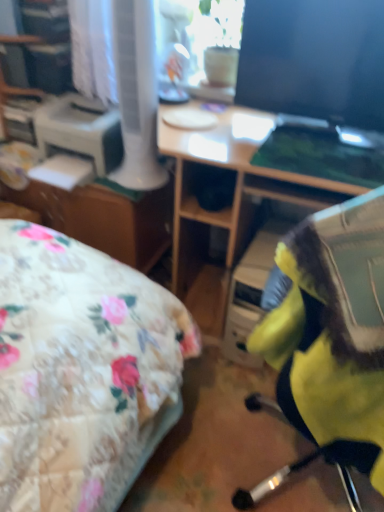
Where is `matte glass window screen at upper center`? matte glass window screen at upper center is located at coordinates (200, 38).

Locate an element on the screen. yellow fabric chair at center is located at coordinates (333, 333).

Measure the distance between matte black monitor at upper right and camera.

matte black monitor at upper right is 1.25 meters away from camera.

Measure the distance between point [268,169] and camera.

The distance of point [268,169] from camera is 4.22 feet.

Locate an element on the screen. The image size is (384, 512). matte glass window screen at upper center is located at coordinates (200, 38).

From the image's perspective, between matte black monitor at upper right and wooden desk at center, which one is located above?

matte black monitor at upper right.

Is matte black monitor at upper right in front of wooden desk at center?

No, matte black monitor at upper right is behind wooden desk at center.

Between matte black monitor at upper right and wooden desk at center, which one has more height?

wooden desk at center.

From a real-world perspective, which object rests below the other?

matte brown file cabinet at center.

From the image's perspective, which one is positioned higher, wooden desk at center or matte brown file cabinet at center?

matte brown file cabinet at center appears higher in the image.

Which object is closer to the camera taking this photo, wooden desk at center or matte brown file cabinet at center?

wooden desk at center.

Does wooden desk at center have a lesser height compared to matte brown file cabinet at center?

Incorrect, the height of wooden desk at center does not fall short of that of matte brown file cabinet at center.

Between white plastic printer at left and yellow fabric chair at center, which one has more height?

yellow fabric chair at center is taller.

From a real-world perspective, is white plastic printer at left positioned above or below yellow fabric chair at center?

Clearly, from a real-world perspective, white plastic printer at left is below yellow fabric chair at center.

In order to click on chair above the white plastic printer at left (from a real-world perspective) in this screenshot , I will do `click(333, 333)`.

Which is behind, white plastic printer at left or yellow fabric chair at center?

white plastic printer at left.

Is white plastic printer at left thinner than matte brown file cabinet at center?

Yes.

Between white plastic printer at left and matte brown file cabinet at center, which one has more height?

matte brown file cabinet at center is taller.

Looking at this image, is white plastic printer at left outside of matte brown file cabinet at center?

Indeed, white plastic printer at left is completely outside matte brown file cabinet at center.

How different are the orientations of white plastic printer at left and matte brown file cabinet at center in degrees?

0.209 degrees.

Between matte brown file cabinet at center and matte glass window screen at upper center, which one has larger size?

matte brown file cabinet at center is bigger.

Does matte brown file cabinet at center lie in front of matte glass window screen at upper center?

No, it is not.

Locate an element on the screen. Image resolution: width=384 pixels, height=512 pixels. file cabinet below the matte glass window screen at upper center (from the image's perspective) is located at coordinates (109, 218).

From a real-world perspective, is matte brown file cabinet at center positioned above or below matte glass window screen at upper center?

matte brown file cabinet at center is below matte glass window screen at upper center.

Can you confirm if matte black monitor at upper right is shorter than yellow fabric chair at center?

Indeed, matte black monitor at upper right has a lesser height compared to yellow fabric chair at center.

Which is closer to the camera, [245,27] or [279,377]?

Point [245,27] is positioned farther from the camera compared to point [279,377].

Considering the relative sizes of matte black monitor at upper right and yellow fabric chair at center in the image provided, is matte black monitor at upper right thinner than yellow fabric chair at center?

Yes.

Does matte black monitor at upper right appear on the right side of yellow fabric chair at center?

Indeed, matte black monitor at upper right is positioned on the right side of yellow fabric chair at center.

Is matte brown file cabinet at center thinner than white plastic printer at left?

In fact, matte brown file cabinet at center might be wider than white plastic printer at left.

Is matte brown file cabinet at center positioned beyond the bounds of white plastic printer at left?

Indeed, matte brown file cabinet at center is completely outside white plastic printer at left.

Could you tell me if matte brown file cabinet at center is turned towards white plastic printer at left?

No, matte brown file cabinet at center is not turned towards white plastic printer at left.

Is matte brown file cabinet at center at the right side of white plastic printer at left?

Indeed, matte brown file cabinet at center is positioned on the right side of white plastic printer at left.

Locate an element on the screen. desk lying on the left of matte black monitor at upper right is located at coordinates (234, 187).

Locate an element on the screen. The height and width of the screenshot is (512, 384). file cabinet behind the wooden desk at center is located at coordinates (109, 218).

When comparing their distances from matte brown file cabinet at center, does matte glass window screen at upper center or wooden desk at center seem further?

matte glass window screen at upper center is positioned further to the anchor matte brown file cabinet at center.

Which object lies further to the anchor point white plastic printer at left, yellow fabric chair at center or matte black monitor at upper right?

Based on the image, yellow fabric chair at center appears to be further to white plastic printer at left.

From the image, which object appears to be farther from wooden desk at center, matte glass window screen at upper center or white plastic printer at left?

white plastic printer at left is positioned further to the anchor wooden desk at center.

Looking at the image, which one is located further to yellow fabric chair at center, matte glass window screen at upper center or white plastic printer at left?

white plastic printer at left is further to yellow fabric chair at center.

Based on their spatial positions, is matte brown file cabinet at center or matte black monitor at upper right further from yellow fabric chair at center?

matte brown file cabinet at center is further to yellow fabric chair at center.

Based on their spatial positions, is wooden desk at center or matte brown file cabinet at center further from white plastic printer at left?

The object further to white plastic printer at left is wooden desk at center.

Based on their spatial positions, is matte glass window screen at upper center or white plastic printer at left further from matte brown file cabinet at center?

Among the two, matte glass window screen at upper center is located further to matte brown file cabinet at center.

Which object lies further to the anchor point wooden desk at center, matte black monitor at upper right or matte glass window screen at upper center?

Among the two, matte glass window screen at upper center is located further to wooden desk at center.

At what (x,y) coordinates should I click in order to perform the action: click on window screen situated between matte brown file cabinet at center and wooden desk at center from left to right. Please return your answer as a coordinate pair (x, y). The image size is (384, 512). Looking at the image, I should click on (200, 38).

The height and width of the screenshot is (512, 384). Find the location of `window screen located between yellow fabric chair at center and white plastic printer at left in the depth direction`. window screen located between yellow fabric chair at center and white plastic printer at left in the depth direction is located at coordinates (200, 38).

The width and height of the screenshot is (384, 512). In order to click on desk between matte brown file cabinet at center and matte black monitor at upper right in the horizontal direction in this screenshot , I will do `click(234, 187)`.

At what (x,y) coordinates should I click in order to perform the action: click on file cabinet located between white plastic printer at left and matte black monitor at upper right in the left-right direction. Please return your answer as a coordinate pair (x, y). The width and height of the screenshot is (384, 512). Looking at the image, I should click on (109, 218).